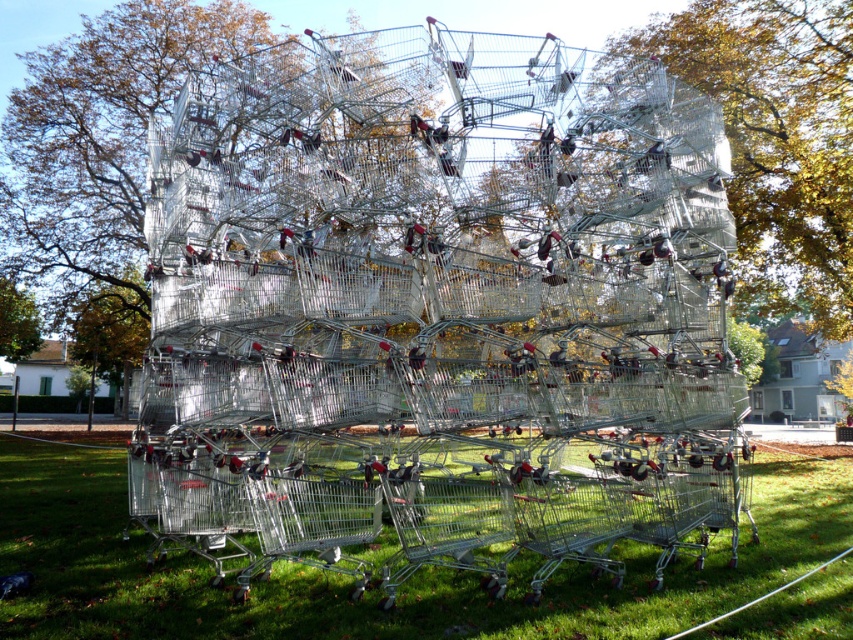
Question: Among these points, which one is farthest from the camera?

Choices:
 (A) (766, 93)
 (B) (27, 339)

Answer: (B)

Question: Which point is farther to the camera?

Choices:
 (A) green leafy tree at upper left
 (B) green grass at center
 (C) green leafy tree at center
 (D) metallic silver shopping cart at center

Answer: (A)

Question: Does green grass at center come in front of green leafy tree at center?

Choices:
 (A) no
 (B) yes

Answer: (B)

Question: Can you confirm if metallic silver shopping cart at center is positioned above green leafy tree at upper left?

Choices:
 (A) no
 (B) yes

Answer: (B)

Question: Is metallic silver shopping cart at center smaller than green leafy tree at upper left?

Choices:
 (A) no
 (B) yes

Answer: (B)

Question: Which point appears farthest from the camera in this image?

Choices:
 (A) (25, 301)
 (B) (259, 592)
 (C) (589, 419)

Answer: (A)